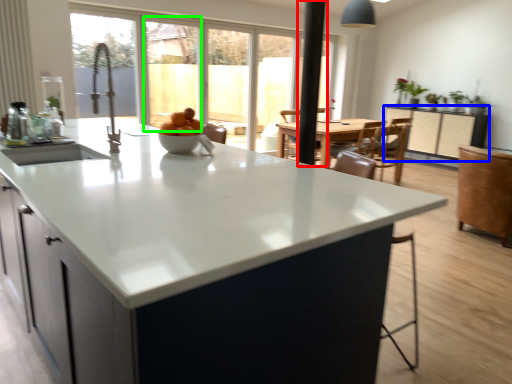
Question: Which object is the farthest from pole (highlighted by a red box)? Choose among these: cabinetry (highlighted by a blue box) or window screen (highlighted by a green box).

Choices:
 (A) cabinetry
 (B) window screen

Answer: (B)